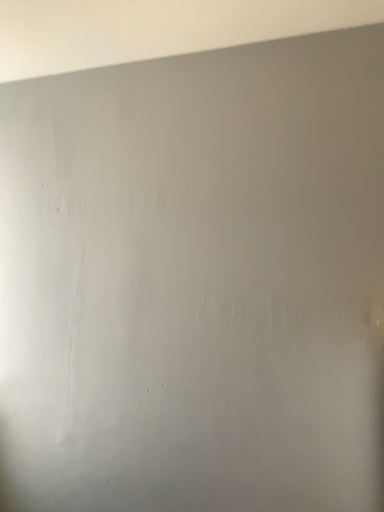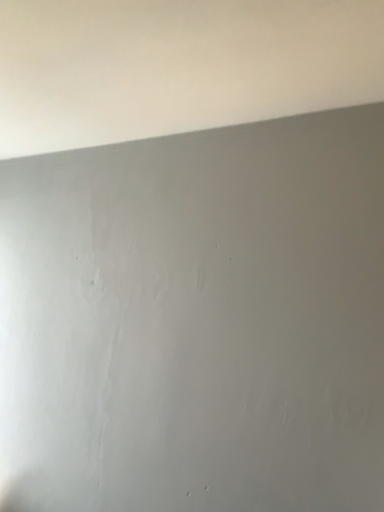
Question: How did the camera likely rotate when shooting the video?

Choices:
 (A) rotated upward
 (B) rotated downward

Answer: (A)